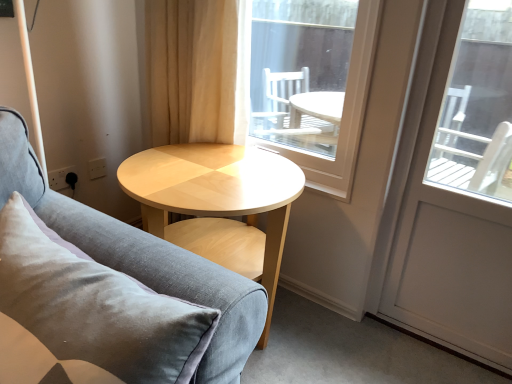
Question: In terms of size, does velvet grey couch at center appear bigger or smaller than transparent glass window at center?

Choices:
 (A) big
 (B) small

Answer: (A)

Question: Does point click(238, 337) appear closer or farther from the camera than point click(347, 107)?

Choices:
 (A) farther
 (B) closer

Answer: (B)

Question: Based on their relative distances, which object is farther from the transparent glass window at center?

Choices:
 (A) white glossy screen door at right
 (B) light wood/texture coffee table at center
 (C) beige fabric curtain at upper center
 (D) velvet grey couch at center

Answer: (D)

Question: Which is nearer to the velvet grey couch at center?

Choices:
 (A) white glossy screen door at right
 (B) light wood/texture coffee table at center
 (C) transparent glass window at center
 (D) beige fabric curtain at upper center

Answer: (B)